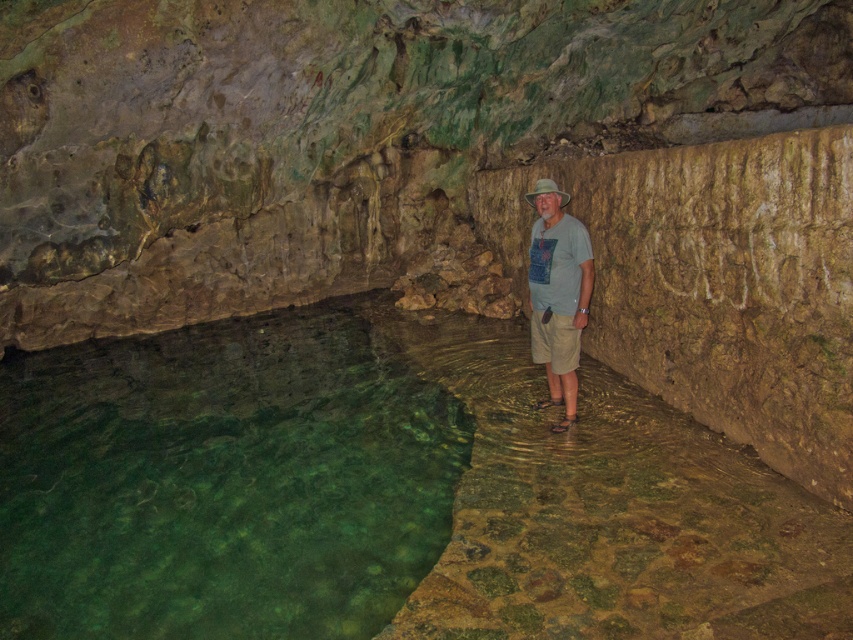
Is point (410, 384) positioned behind point (573, 282)?

Yes, it is.

Does green translucent water at lower left appear under light gray t-shirt at center?

Indeed, green translucent water at lower left is positioned under light gray t-shirt at center.

Does point (276, 483) come behind point (560, 300)?

No, (276, 483) is closer to viewer.

Where is `green translucent water at lower left`? green translucent water at lower left is located at coordinates (222, 481).